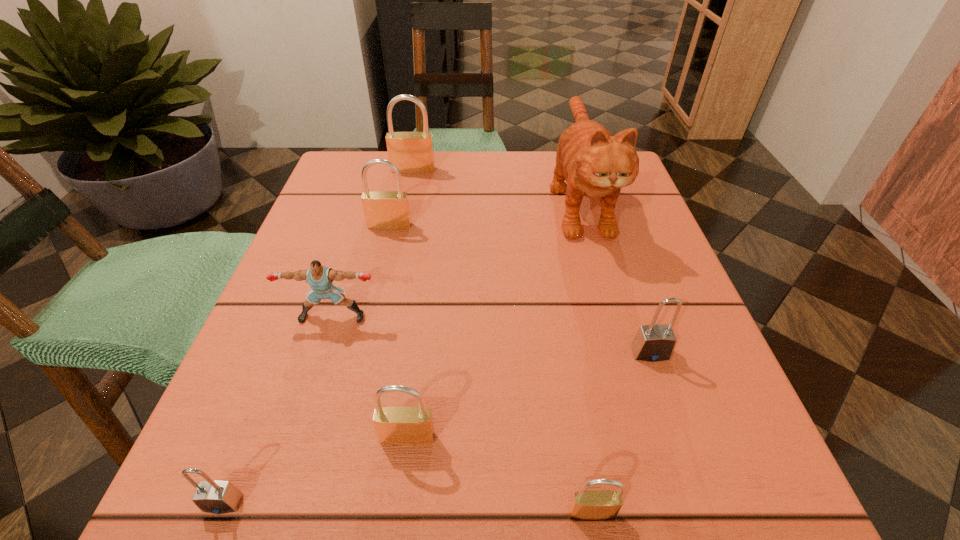
In order to click on vacant space at the near edge of the desktop in this screenshot , I will do `click(349, 519)`.

In the image, there is a desktop. At what (x,y) coordinates should I click in order to perform the action: click on vacant space at the left edge. Please return your answer as a coordinate pair (x, y). This screenshot has height=540, width=960. Looking at the image, I should click on (332, 260).

Identify the location of vacant space at the right edge of the desktop. (677, 367).

Locate an element on the screen. The height and width of the screenshot is (540, 960). vacant space at the far left corner of the desktop is located at coordinates (340, 206).

Find the location of a particular element. The image size is (960, 540). free space at the near right corner is located at coordinates (x=662, y=477).

Locate an element on the screen. empty space between the rightmost brass padlock and the cat is located at coordinates (586, 356).

The height and width of the screenshot is (540, 960). I want to click on free point between the nearest brass padlock and the second tallest object, so click(502, 341).

The image size is (960, 540). What are the coordinates of `vacant point located between the biggest brass padlock and the third farthest brass padlock` in the screenshot? It's located at (410, 303).

What are the coordinates of `free space between the sixth shortest object and the sixth farthest object` in the screenshot? It's located at (398, 332).

Identify the location of vacant area that lies between the red puncher and the smaller gray padlock. Image resolution: width=960 pixels, height=540 pixels. (277, 409).